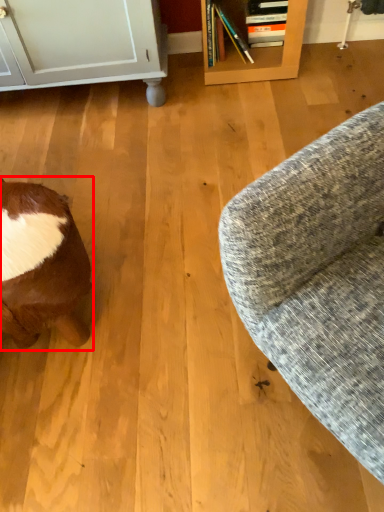
Question: From the image, what is the correct spatial relationship of animal (annotated by the red box) in relation to studio couch?

Choices:
 (A) left
 (B) right

Answer: (A)